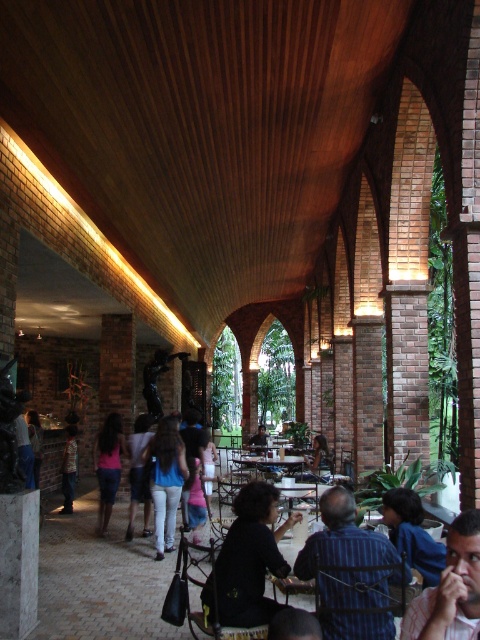
Consider the image. You are standing in the indoor space and want to move from the point at coordinates point (69, 451) to the point at coordinates point (286, 458). Which direction should you move to reach your destination?

To move from point (69, 451) to point (286, 458), you should move backward since point (69, 451) is in front of point (286, 458).

You are a delivery person carrying a package that requires a 3.5 feet clearance to pass through. You need to navigate between the black matte shirt at center and the blue denim shirt at lower right. Can you safely pass through the space between them with the package?

The distance between the black matte shirt at center and the blue denim shirt at lower right is 3.47 feet, which is slightly less than the required 3.5 feet clearance. Therefore, it might be risky to attempt passing through as there is insufficient space. Consider finding an alternative route with more clearance.